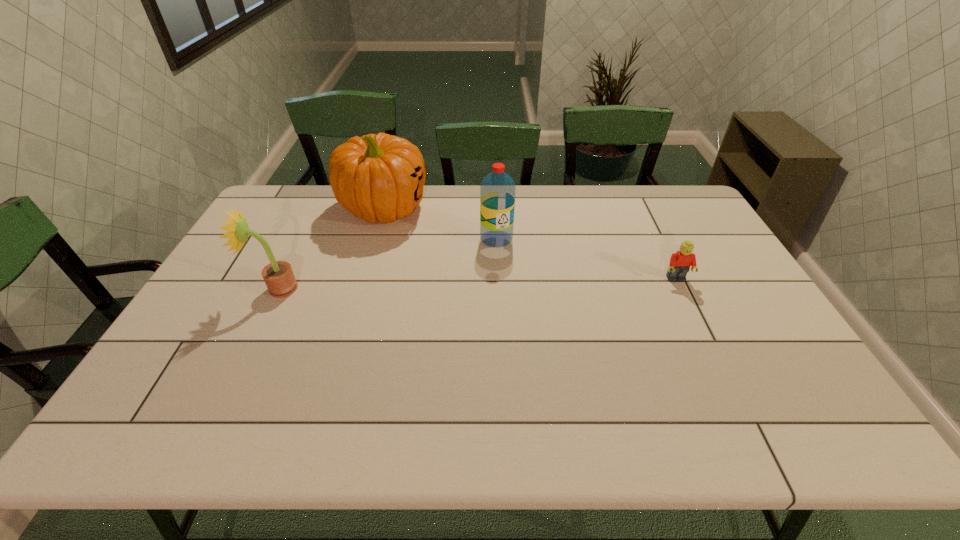
You are a GUI agent. You are given a task and a screenshot of the screen. Output one action in this format:
    pyautogui.click(x=<x>, y=<y>)
    Task: Click on the vacant point located between the sunflower and the third object from left to right
    
    Given the screenshot: What is the action you would take?
    pyautogui.click(x=387, y=264)

The image size is (960, 540). Find the location of `blank region between the shortest object and the water bottle`. blank region between the shortest object and the water bottle is located at coordinates (587, 259).

At what (x,y) coordinates should I click in order to perform the action: click on vacant space in between the third object from right to left and the sunflower. Please return your answer as a coordinate pair (x, y). The height and width of the screenshot is (540, 960). Looking at the image, I should click on (330, 248).

At what (x,y) coordinates should I click in order to perform the action: click on free point between the water bottle and the third object from right to left. Please return your answer as a coordinate pair (x, y). The height and width of the screenshot is (540, 960). Looking at the image, I should click on (440, 224).

Find the location of a particular element. The image size is (960, 540). the second closest object to the pumpkin is located at coordinates (279, 278).

In order to click on the second closest object to the third object from right to left in this screenshot , I will do point(279,278).